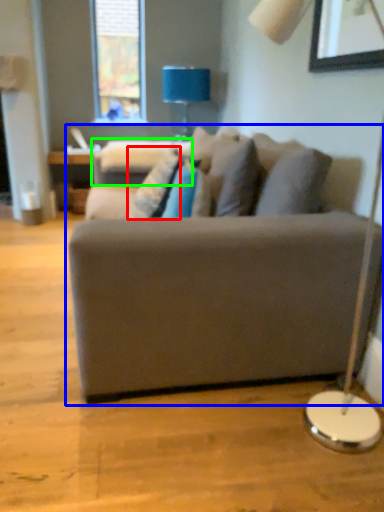
Question: Which object is positioned closest to pillow (highlighted by a red box)? Select from studio couch (highlighted by a blue box) and swivel chair (highlighted by a green box).

Choices:
 (A) studio couch
 (B) swivel chair

Answer: (B)